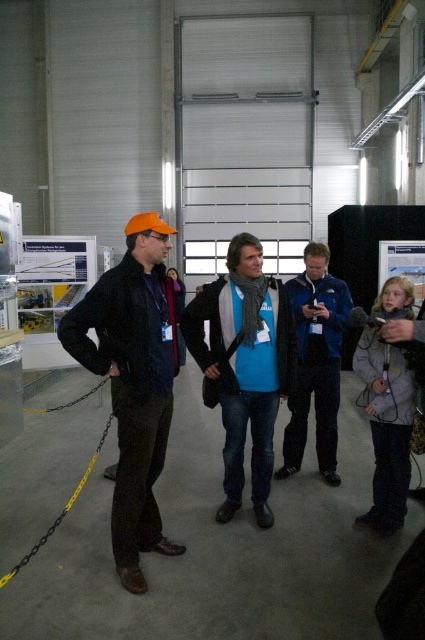
Does blue matte shirt at center have a lesser width compared to blue fabric jacket at center?

No.

How distant is blue matte shirt at center from blue fabric jacket at center?

blue matte shirt at center and blue fabric jacket at center are 20.24 inches apart from each other.

Measure the distance between blue matte shirt at center and camera.

9.66 feet

I want to click on blue matte shirt at center, so click(243, 365).

Who is more forward, (70,332) or (227,488)?

Positioned in front is point (70,332).

Who is taller, matte black jacket at left or blue matte shirt at center?

Standing taller between the two is matte black jacket at left.

This screenshot has height=640, width=425. What are the coordinates of `matte black jacket at left` in the screenshot? It's located at (133, 381).

Is matte black jacket at left behind blue fabric jacket at center?

No, matte black jacket at left is in front of blue fabric jacket at center.

From the picture: Measure the distance between matte black jacket at left and camera.

The distance of matte black jacket at left from camera is 2.34 meters.

Which is behind, point (116, 392) or point (328, 355)?

The point (328, 355) is behind.

What are the coordinates of `matte black jacket at left` in the screenshot? It's located at (133, 381).